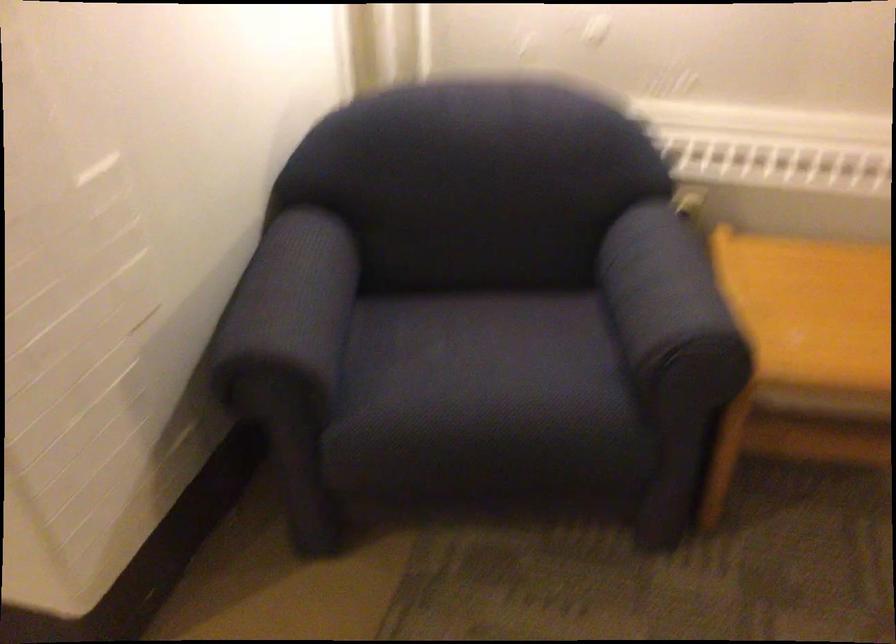
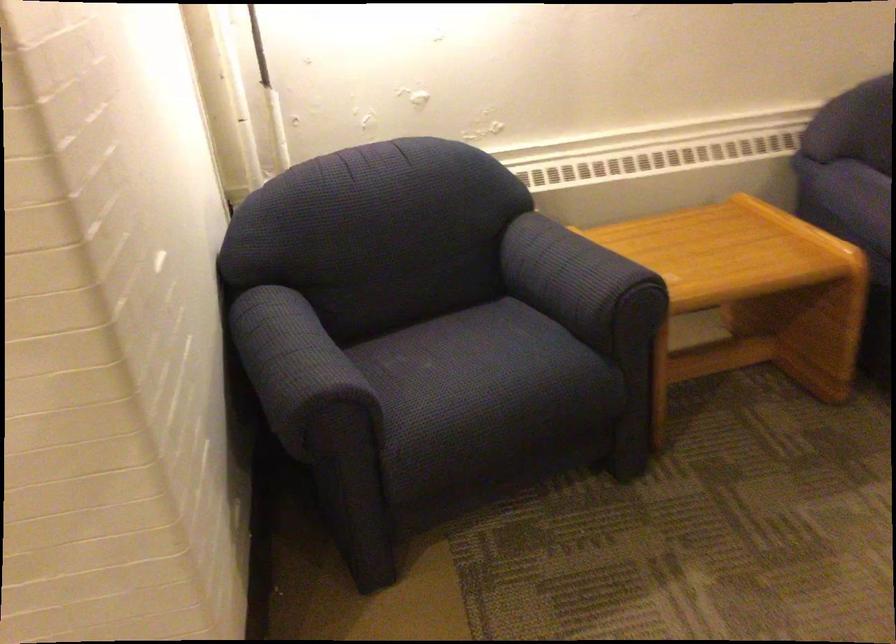
Locate, in the second image, the point that corresponds to point 635,307 in the first image.

(579, 281)